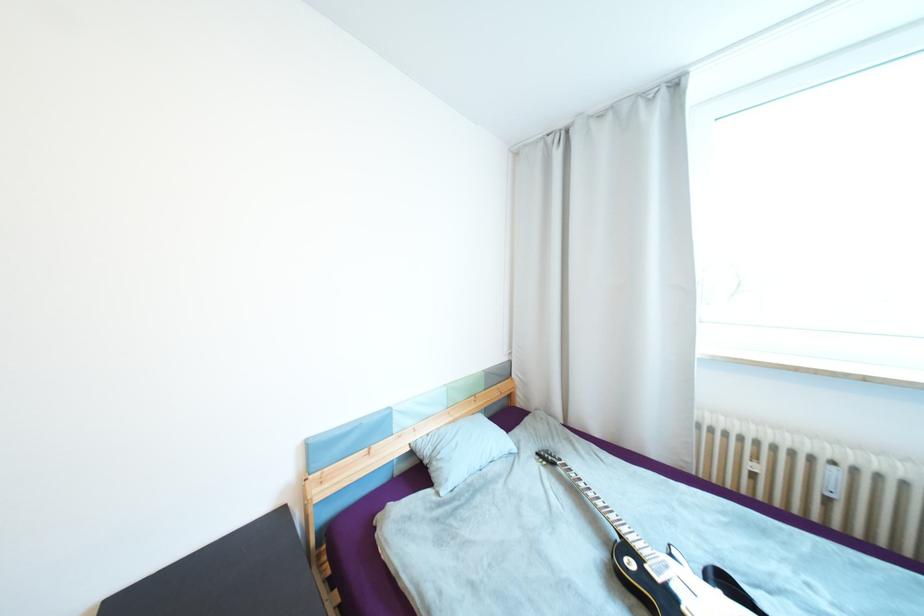
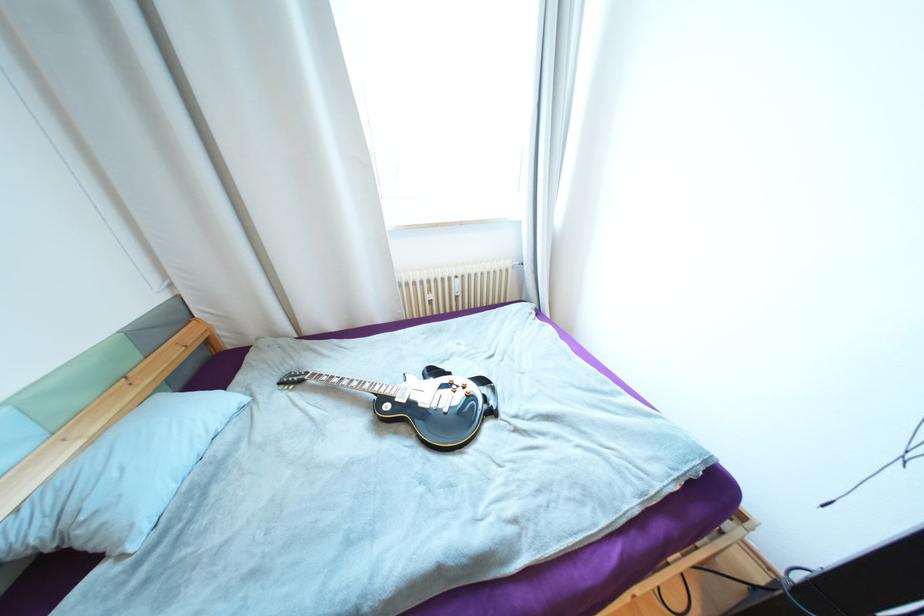
The point at (445, 466) is marked in the first image. Where is the corresponding point in the second image?

(101, 525)